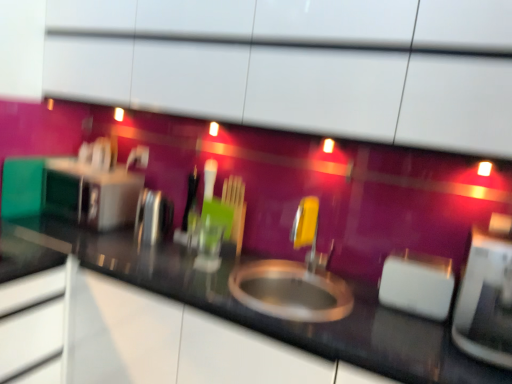
Question: From the image's perspective, is satin silver toaster at left, marked as the fourth appliance in a right-to-left arrangement, on polished stainless steel kettle at left, which is the third appliance in right-to-left order?

Choices:
 (A) yes
 (B) no

Answer: (A)

Question: Is satin silver toaster at left, marked as the fourth appliance in a right-to-left arrangement, bigger than polished stainless steel kettle at left, which ranks as the 3th appliance in front-to-back order?

Choices:
 (A) yes
 (B) no

Answer: (A)

Question: From the image's perspective, would you say satin silver toaster at left, marked as the fourth appliance in a right-to-left arrangement, is shown under polished stainless steel kettle at left, which is the 2th appliance in left-to-right order?

Choices:
 (A) no
 (B) yes

Answer: (A)

Question: Is satin silver toaster at left, marked as the fourth appliance in a right-to-left arrangement, positioned before polished stainless steel kettle at left, which is the third appliance in right-to-left order?

Choices:
 (A) no
 (B) yes

Answer: (A)

Question: Is satin silver toaster at left, the 1th appliance viewed from the left, not near polished stainless steel kettle at left, which ranks as the 3th appliance in front-to-back order?

Choices:
 (A) no
 (B) yes

Answer: (A)

Question: Looking at their shapes, would you say polished stainless steel kettle at left, arranged as the 2th appliance when viewed from the back, is wider or thinner than white plastic toaster at right, arranged as the 2th appliance when viewed from the front?

Choices:
 (A) wide
 (B) thin

Answer: (B)

Question: Considering the positions of point (x=161, y=236) and point (x=411, y=288), is point (x=161, y=236) closer or farther from the camera than point (x=411, y=288)?

Choices:
 (A) farther
 (B) closer

Answer: (A)

Question: From a real-world perspective, is polished stainless steel kettle at left, arranged as the 2th appliance when viewed from the back, physically located above or below white plastic toaster at right, the second appliance when ordered from right to left?

Choices:
 (A) above
 (B) below

Answer: (A)

Question: Is polished stainless steel kettle at left, arranged as the 2th appliance when viewed from the back, to the left or to the right of white plastic toaster at right, which ranks as the third appliance in back-to-front order, in the image?

Choices:
 (A) right
 (B) left

Answer: (B)

Question: Is white glossy toaster at right, which is the 1th appliance from right to left, inside the boundaries of yellow plastic faucet at center, or outside?

Choices:
 (A) inside
 (B) outside

Answer: (B)

Question: Is white glossy toaster at right, marked as the fourth appliance in a back-to-front arrangement, to the left or to the right of yellow plastic faucet at center in the image?

Choices:
 (A) left
 (B) right

Answer: (B)

Question: From the image's perspective, is white glossy toaster at right, which is counted as the 4th appliance, starting from the left, above or below yellow plastic faucet at center?

Choices:
 (A) above
 (B) below

Answer: (B)

Question: Looking at their shapes, would you say white glossy toaster at right, acting as the first appliance starting from the front, is wider or thinner than yellow plastic faucet at center?

Choices:
 (A) thin
 (B) wide

Answer: (B)

Question: From the image's perspective, relative to white plastic toaster at right, arranged as the 2th appliance when viewed from the front, is black glossy countertop at center above or below?

Choices:
 (A) below
 (B) above

Answer: (A)

Question: In terms of size, does black glossy countertop at center appear bigger or smaller than white plastic toaster at right, arranged as the 2th appliance when viewed from the front?

Choices:
 (A) big
 (B) small

Answer: (A)